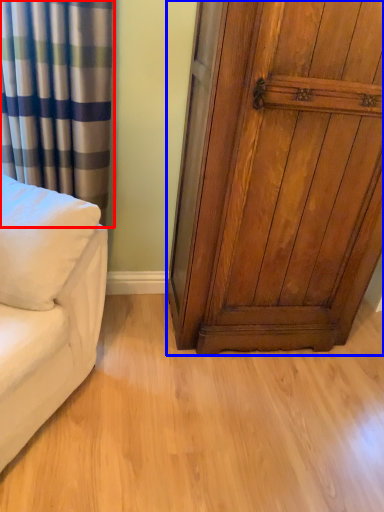
Question: Which point is further to the camera, curtain (highlighted by a red box) or door (highlighted by a blue box)?

Choices:
 (A) curtain
 (B) door

Answer: (A)